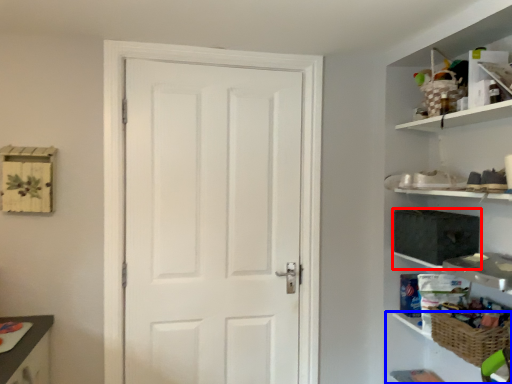
Question: Which object appears farthest to the camera in this image, medicine cabinet (highlighted by a red box) or cabinet (highlighted by a blue box)?

Choices:
 (A) medicine cabinet
 (B) cabinet

Answer: (A)